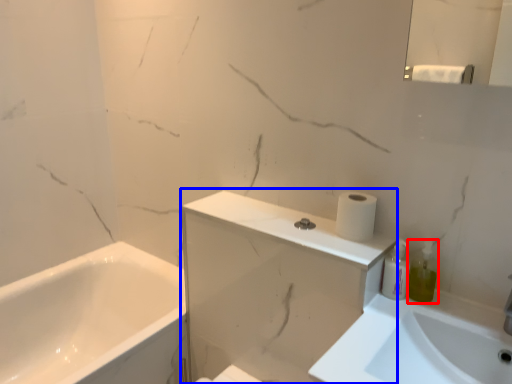
Question: Which object is closer to the camera taking this photo, soap dispenser (highlighted by a red box) or medicine cabinet (highlighted by a blue box)?

Choices:
 (A) soap dispenser
 (B) medicine cabinet

Answer: (B)